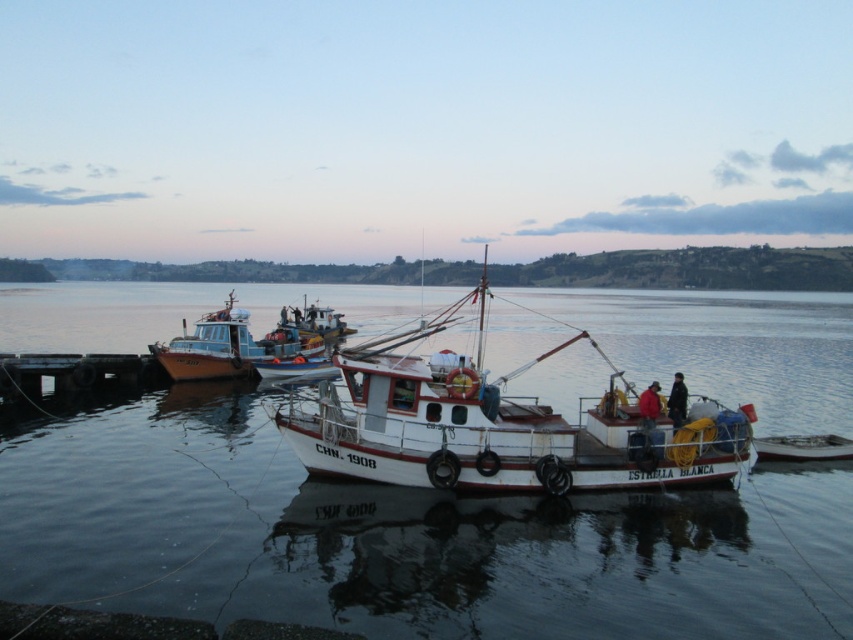
Does white matte boat at center have a greater width compared to red fabric jacket at center?

Yes, white matte boat at center is wider than red fabric jacket at center.

Is point (619, 412) in front of point (648, 401)?

No, (619, 412) is further to viewer.

Image resolution: width=853 pixels, height=640 pixels. Find the location of `white matte boat at center`. white matte boat at center is located at coordinates (498, 426).

Which is below, white matte boat at center or wooden boat at left?

white matte boat at center

Who is taller, white matte boat at center or wooden boat at left?

Standing taller between the two is white matte boat at center.

Is point (637, 419) positioned in front of point (216, 374)?

That is True.

Locate an element on the screen. The image size is (853, 640). white matte boat at center is located at coordinates (498, 426).

Between point (410, 604) and point (200, 320), which one is positioned behind?

The point (200, 320) is behind.

This screenshot has width=853, height=640. Describe the element at coordinates (401, 538) in the screenshot. I see `white glossy water at center` at that location.

I want to click on white glossy water at center, so click(401, 538).